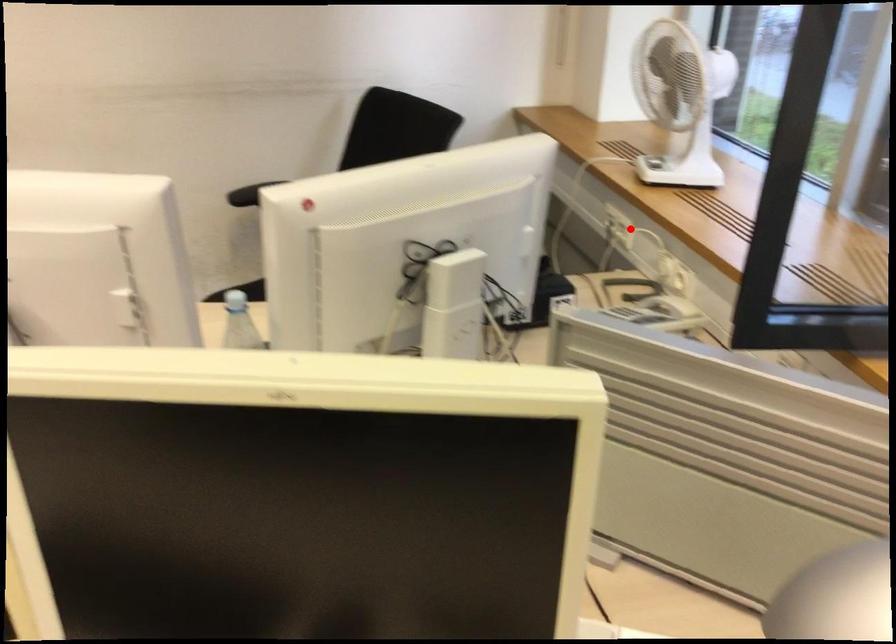
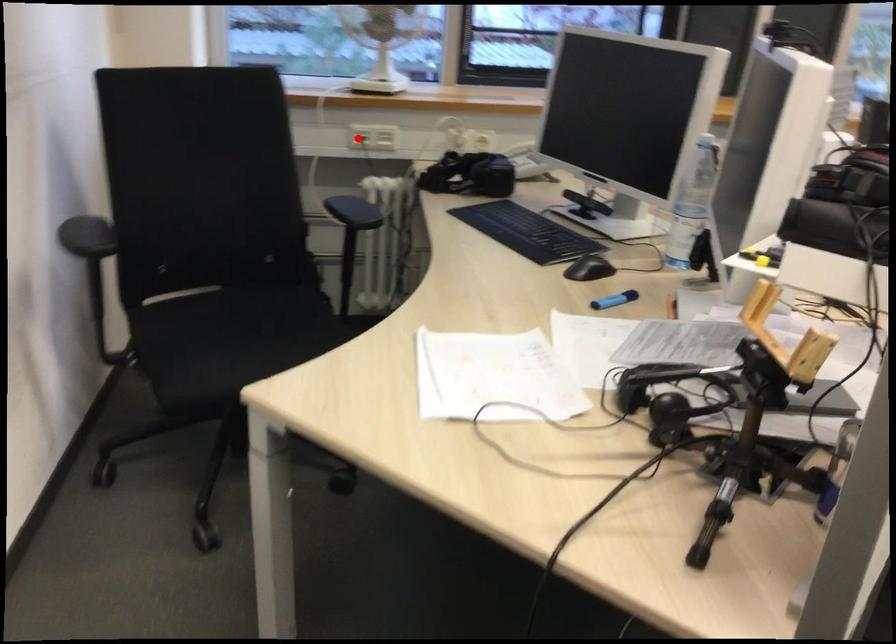
From the picture: I am providing you with two images of the same scene from different viewpoints. A red point is marked on the first image and another point is marked on the second image. Is the red point in image1 aligned with the point shown in image2?

No